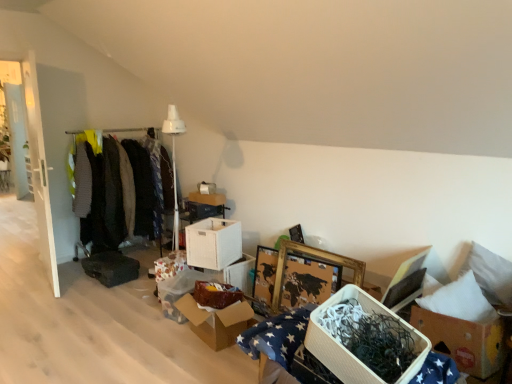
Locate an element on the screen. This screenshot has height=384, width=512. vacant area that lies in front of matte cardboard box at center, the second storage box when ordered from front to back is located at coordinates (161, 333).